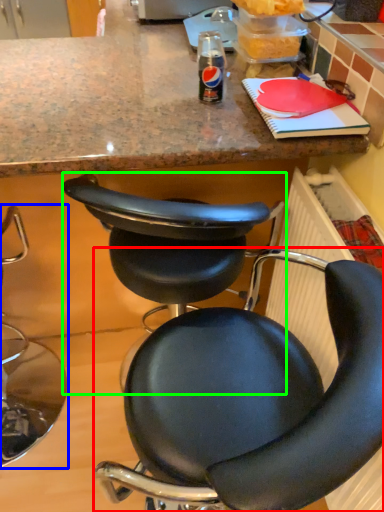
Question: Which is nearer to the chair (highlighted by a red box)? chair (highlighted by a blue box) or chair (highlighted by a green box).

Choices:
 (A) chair
 (B) chair

Answer: (B)